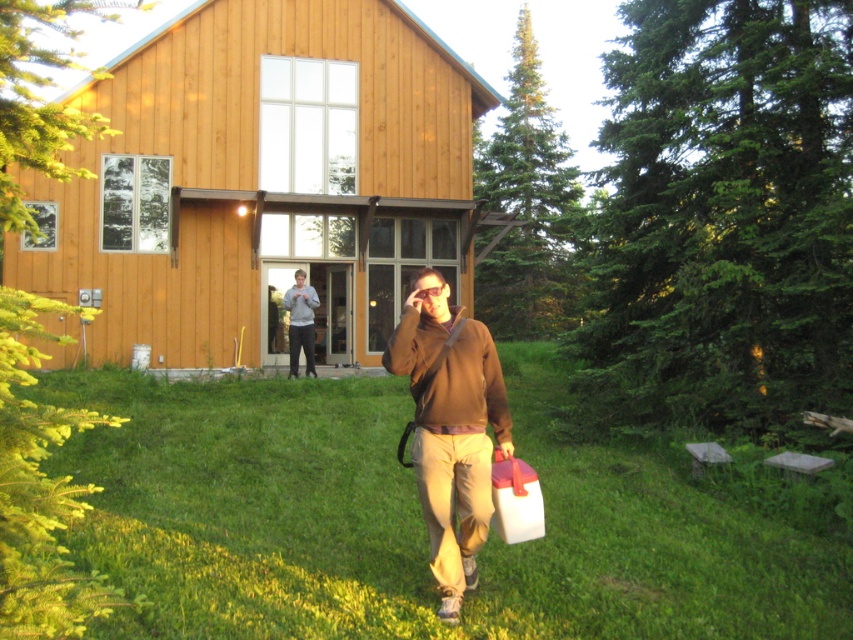
Question: Can you confirm if wooden cabin at center is positioned to the right of gray cotton sweatshirt at center?

Choices:
 (A) no
 (B) yes

Answer: (A)

Question: Is green grass at center bigger than gray cotton sweatshirt at center?

Choices:
 (A) no
 (B) yes

Answer: (B)

Question: Which object is the farthest from the wooden cabin at center?

Choices:
 (A) gray cotton sweatshirt at center
 (B) brown fleece jacket at center
 (C) green grass at center

Answer: (B)

Question: Among these points, which one is nearest to the camera?

Choices:
 (A) (308, 324)
 (B) (234, 349)

Answer: (A)

Question: Which point is closer to the camera taking this photo?

Choices:
 (A) (467, 577)
 (B) (241, 294)
 (C) (294, 300)

Answer: (A)

Question: Can you confirm if green grass at center is positioned to the left of gray cotton sweatshirt at center?

Choices:
 (A) yes
 (B) no

Answer: (B)